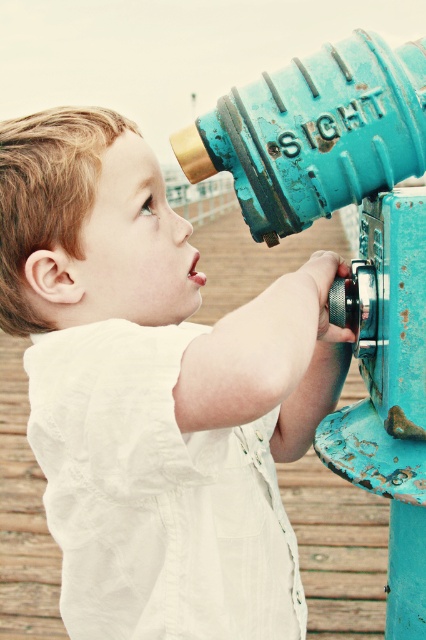
Does matte blue telescope at center appear on the left side of teal matte/rough sightseeing telescope at center?

Indeed, matte blue telescope at center is positioned on the left side of teal matte/rough sightseeing telescope at center.

Is matte blue telescope at center smaller than teal matte/rough sightseeing telescope at center?

Incorrect, matte blue telescope at center is not smaller in size than teal matte/rough sightseeing telescope at center.

The image size is (426, 640). What do you see at coordinates (157, 388) in the screenshot? I see `matte blue telescope at center` at bounding box center [157, 388].

This screenshot has width=426, height=640. I want to click on matte blue telescope at center, so click(x=157, y=388).